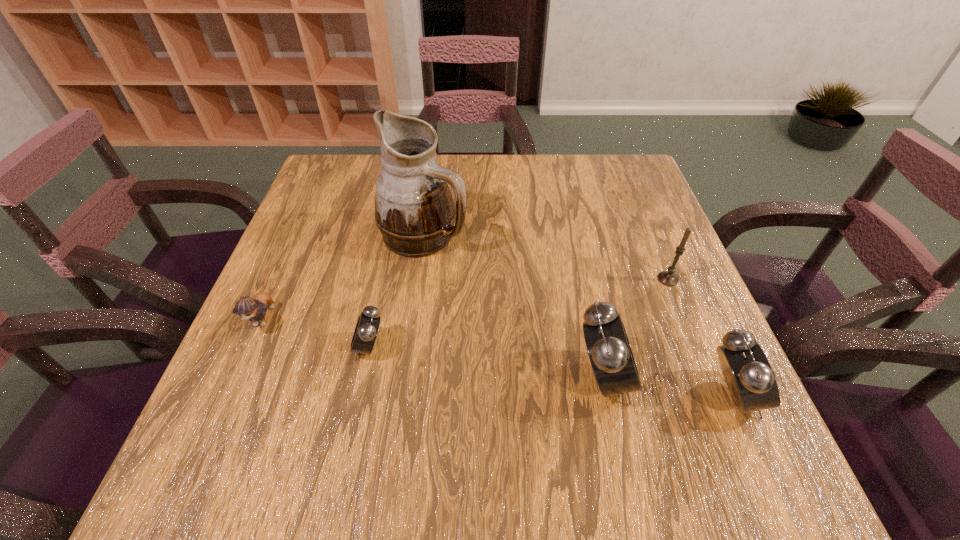
Locate an element on the screen. The width and height of the screenshot is (960, 540). the shortest alarm clock is located at coordinates (366, 330).

Locate an element on the screen. This screenshot has width=960, height=540. the second alarm clock from left to right is located at coordinates (611, 357).

Image resolution: width=960 pixels, height=540 pixels. In order to click on the second shortest alarm clock in this screenshot , I will do `click(750, 379)`.

This screenshot has height=540, width=960. I want to click on candle, so click(x=668, y=278).

Locate an element on the screen. Image resolution: width=960 pixels, height=540 pixels. the tallest object is located at coordinates (414, 209).

Find the location of a particular element. the farthest object is located at coordinates (414, 209).

I want to click on the leftmost object, so pos(247,308).

The image size is (960, 540). Find the location of `vacant space located 0.060m on the face of the leftmost alarm clock`. vacant space located 0.060m on the face of the leftmost alarm clock is located at coordinates (321, 347).

Where is `vacant space located on the face of the leftmost alarm clock`? vacant space located on the face of the leftmost alarm clock is located at coordinates (316, 347).

Where is `vacant area located 0.080m on the face of the leftmost alarm clock`? vacant area located 0.080m on the face of the leftmost alarm clock is located at coordinates (310, 347).